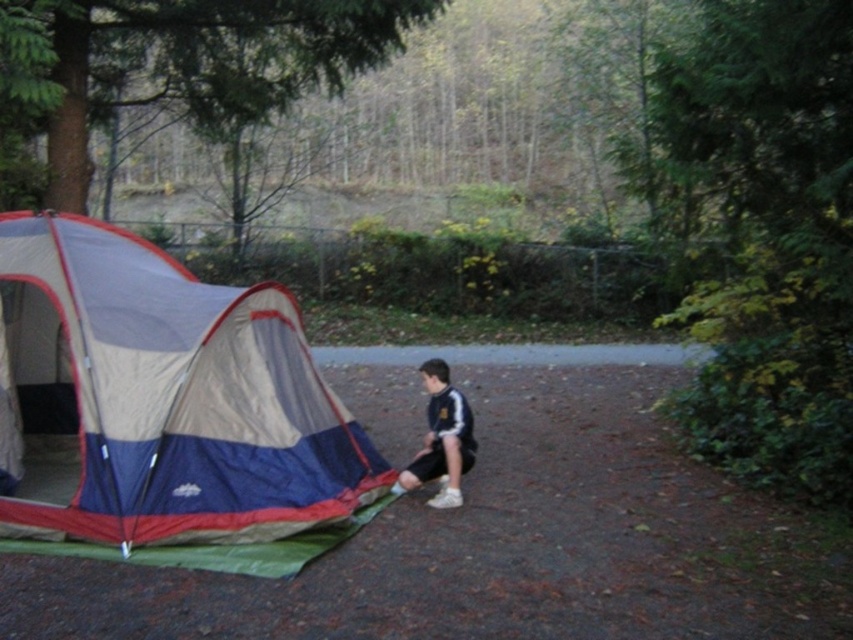
Which is in front, point (83, 454) or point (434, 396)?

Point (83, 454)

Does point (96, 364) come in front of point (457, 424)?

Yes, it is in front of point (457, 424).

Is point (112, 426) closer to viewer compared to point (438, 461)?

Yes, it is in front of point (438, 461).

Where is `blue fabric tent at left`? The width and height of the screenshot is (853, 640). blue fabric tent at left is located at coordinates (169, 410).